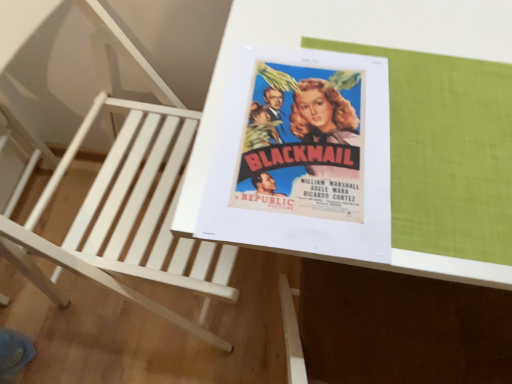
Question: Is matte paper poster at center at the back of white glossy table at center?

Choices:
 (A) yes
 (B) no

Answer: (B)

Question: Is white glossy table at center not inside matte paper poster at center?

Choices:
 (A) no
 (B) yes

Answer: (B)

Question: From a real-world perspective, is white glossy table at center on top of matte paper poster at center?

Choices:
 (A) yes
 (B) no

Answer: (B)

Question: From the image's perspective, would you say white glossy table at center is shown under matte paper poster at center?

Choices:
 (A) yes
 (B) no

Answer: (A)

Question: Is white glossy table at center behind matte paper poster at center?

Choices:
 (A) no
 (B) yes

Answer: (A)

Question: From the image's perspective, would you say white glossy table at center is positioned over matte paper poster at center?

Choices:
 (A) yes
 (B) no

Answer: (B)

Question: Is matte paper poster at center wider than white wood chair at upper left?

Choices:
 (A) no
 (B) yes

Answer: (A)

Question: Is matte paper poster at center next to white wood chair at upper left?

Choices:
 (A) no
 (B) yes

Answer: (A)

Question: Would you say matte paper poster at center is outside white wood chair at upper left?

Choices:
 (A) yes
 (B) no

Answer: (B)

Question: Is matte paper poster at center at the right side of white wood chair at upper left?

Choices:
 (A) yes
 (B) no

Answer: (A)

Question: From a real-world perspective, is matte paper poster at center positioned under white wood chair at upper left based on gravity?

Choices:
 (A) no
 (B) yes

Answer: (A)

Question: Does matte paper poster at center have a lesser width compared to white wood chair at upper left?

Choices:
 (A) no
 (B) yes

Answer: (B)

Question: Is white wood chair at upper left bigger than matte paper poster at center?

Choices:
 (A) no
 (B) yes

Answer: (B)